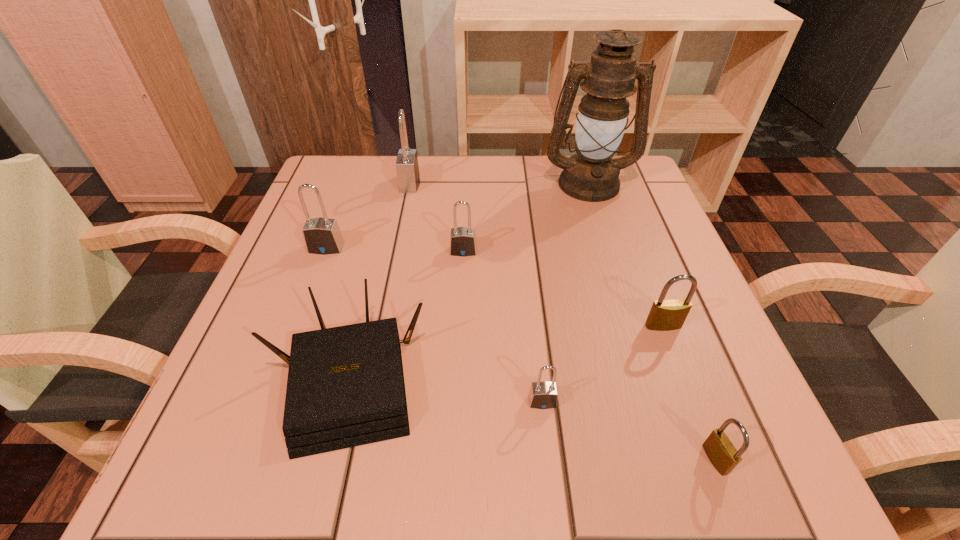
Image resolution: width=960 pixels, height=540 pixels. In order to click on object that is at the near right corner in this screenshot , I will do `click(719, 449)`.

Identify the location of vacant space at the far edge. (458, 206).

You are a GUI agent. You are given a task and a screenshot of the screen. Output one action in this format:
    pyautogui.click(x=<x>, y=<y>)
    Task: Click on the vacant space at the near edge of the desktop
    Image resolution: width=960 pixels, height=540 pixels.
    Given the screenshot: What is the action you would take?
    tap(602, 458)

Locate an element on the screen. The image size is (960, 540). vacant space at the left edge of the desktop is located at coordinates (307, 313).

This screenshot has height=540, width=960. I want to click on vacant space at the right edge of the desktop, so (x=647, y=348).

In the image, there is a desktop. Find the location of `blank space at the far left corner`. blank space at the far left corner is located at coordinates (334, 184).

In the image, there is a desktop. Identify the location of vacant space at the far right corner. The image size is (960, 540). (641, 208).

The image size is (960, 540). In the image, there is a desktop. Identify the location of free space at the near right corner. (732, 433).

Find the location of a particular element. The width and height of the screenshot is (960, 540). vacant area that lies between the oil lamp and the nearest gray padlock is located at coordinates pyautogui.click(x=565, y=292).

Locate an element on the screen. The width and height of the screenshot is (960, 540). vacant area that lies between the seventh shortest object and the nearest gray padlock is located at coordinates click(x=476, y=292).